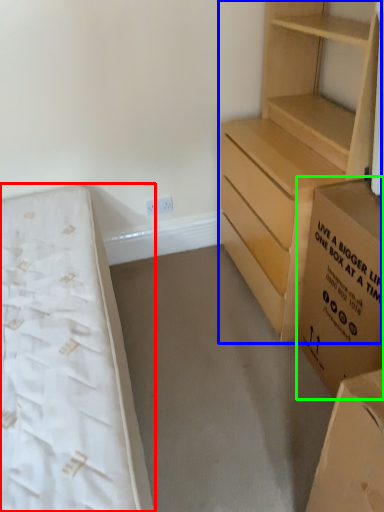
Question: Estimate the real-world distances between objects in this image. Which object is closer to bed (highlighted by a red box), chest of drawers (highlighted by a blue box) or cardboard box (highlighted by a green box)?

Choices:
 (A) chest of drawers
 (B) cardboard box

Answer: (B)